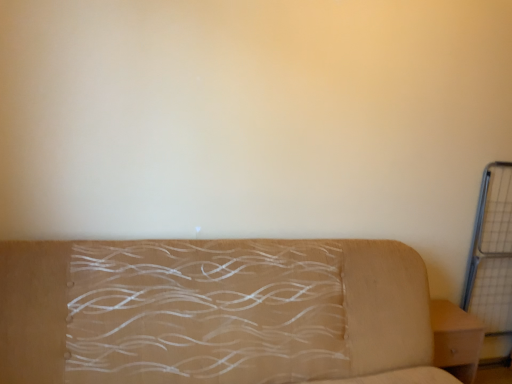
Question: From the image's perspective, would you say beige fabric couch at center is positioned over metal grid at right?

Choices:
 (A) yes
 (B) no

Answer: (B)

Question: Does beige fabric couch at center turn towards metal grid at right?

Choices:
 (A) no
 (B) yes

Answer: (A)

Question: Is beige fabric couch at center to the left of metal grid at right from the viewer's perspective?

Choices:
 (A) no
 (B) yes

Answer: (B)

Question: Is beige fabric couch at center taller than metal grid at right?

Choices:
 (A) no
 (B) yes

Answer: (A)

Question: Would you say beige fabric couch at center is a long distance from metal grid at right?

Choices:
 (A) yes
 (B) no

Answer: (A)

Question: Considering the positions of light brown wood nightstand at lower right and beige fabric couch at center in the image, is light brown wood nightstand at lower right taller or shorter than beige fabric couch at center?

Choices:
 (A) tall
 (B) short

Answer: (B)

Question: Considering the positions of point (450, 329) and point (6, 274), is point (450, 329) closer or farther from the camera than point (6, 274)?

Choices:
 (A) closer
 (B) farther

Answer: (B)

Question: From a real-world perspective, is light brown wood nightstand at lower right above or below beige fabric couch at center?

Choices:
 (A) above
 (B) below

Answer: (B)

Question: Would you say light brown wood nightstand at lower right is to the left or to the right of beige fabric couch at center in the picture?

Choices:
 (A) right
 (B) left

Answer: (A)

Question: Considering the positions of beige fabric couch at center and light brown wood nightstand at lower right in the image, is beige fabric couch at center wider or thinner than light brown wood nightstand at lower right?

Choices:
 (A) thin
 (B) wide

Answer: (B)

Question: From the image's perspective, is beige fabric couch at center located above or below light brown wood nightstand at lower right?

Choices:
 (A) below
 (B) above

Answer: (B)

Question: Would you say beige fabric couch at center is inside or outside light brown wood nightstand at lower right?

Choices:
 (A) outside
 (B) inside

Answer: (A)

Question: Is beige fabric couch at center in front of or behind light brown wood nightstand at lower right in the image?

Choices:
 (A) behind
 (B) front

Answer: (B)

Question: In terms of size, does metal grid at right appear bigger or smaller than light brown wood nightstand at lower right?

Choices:
 (A) big
 (B) small

Answer: (A)

Question: Is metal grid at right in front of or behind light brown wood nightstand at lower right in the image?

Choices:
 (A) behind
 (B) front

Answer: (A)